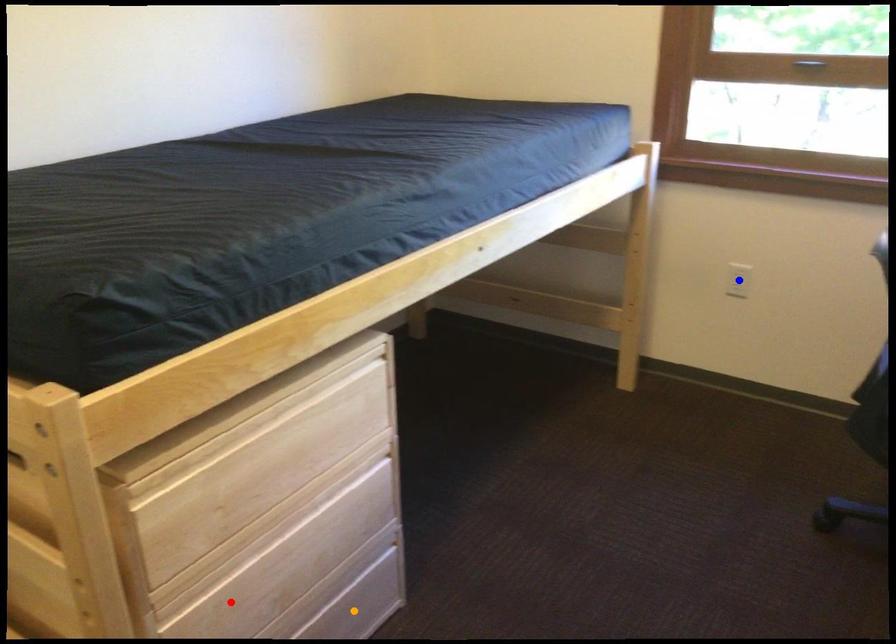
Order these from nearest to farthest:
- orange point
- red point
- blue point

1. blue point
2. orange point
3. red point